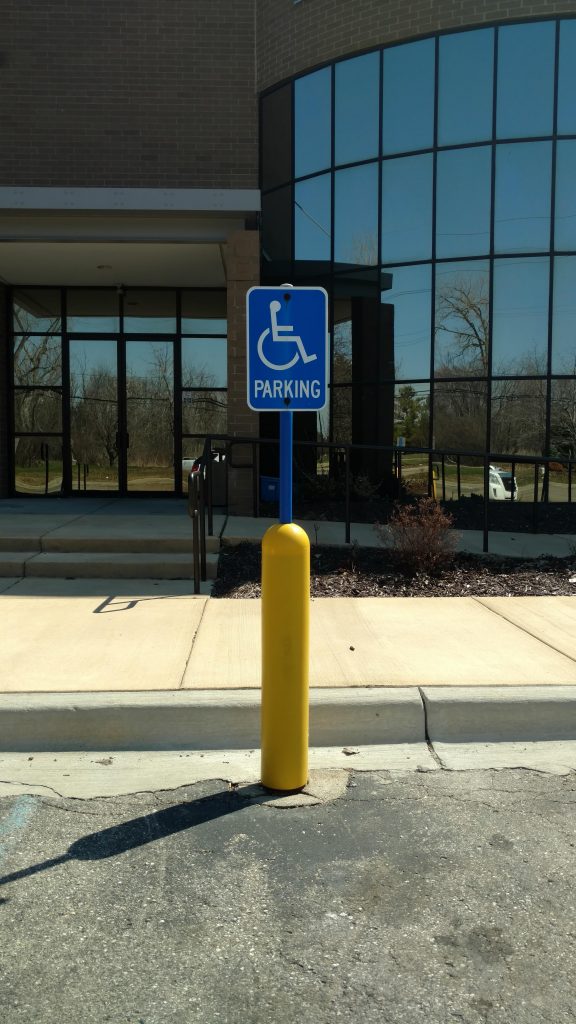
Where is `square windows`? Image resolution: width=576 pixels, height=1024 pixels. square windows is located at coordinates (40, 454), (53, 413), (36, 366), (30, 312), (90, 306), (132, 310), (187, 311), (206, 361), (199, 407), (196, 454).